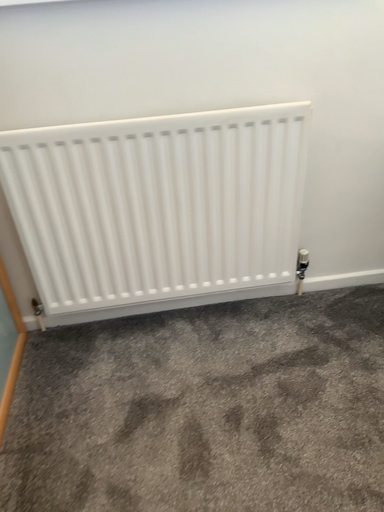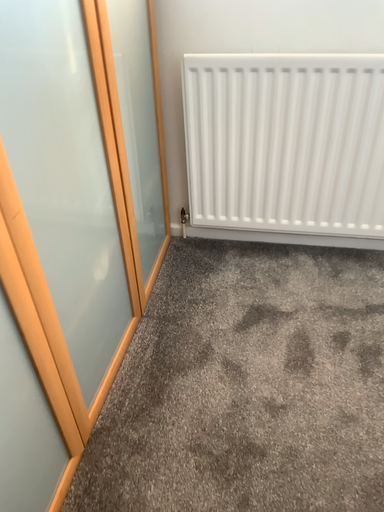
Question: How did the camera likely rotate when shooting the video?

Choices:
 (A) rotated right
 (B) rotated left

Answer: (B)